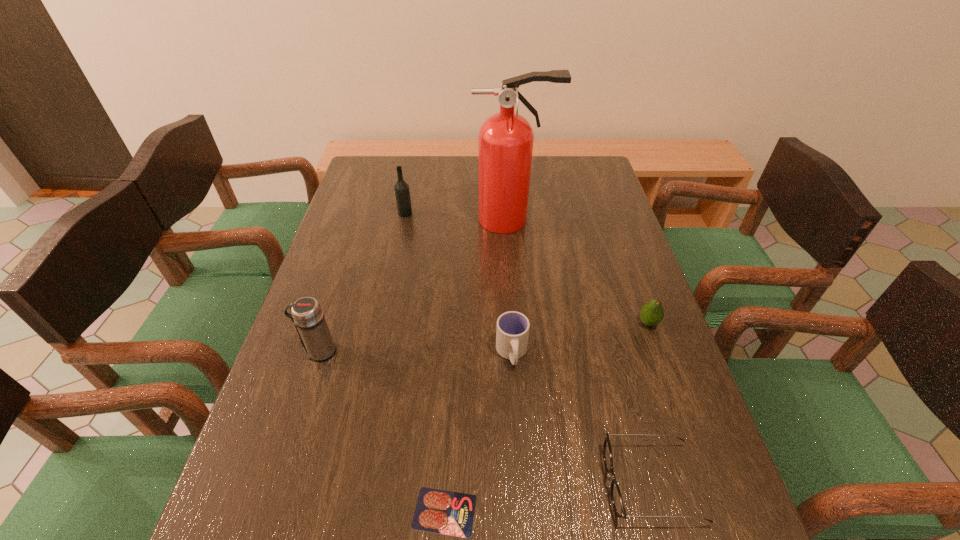
At what (x,y) coordinates should I click in order to perform the action: click on the tallest object. Please return your answer as a coordinate pair (x, y). The width and height of the screenshot is (960, 540). Looking at the image, I should click on point(505,140).

This screenshot has height=540, width=960. What are the coordinates of `the sixth object from right to left` in the screenshot? It's located at (402, 192).

You are a GUI agent. You are given a task and a screenshot of the screen. Output one action in this format:
    pyautogui.click(x=<x>, y=<y>)
    Task: Click on the thermos bottle
    The width and height of the screenshot is (960, 540).
    Given the screenshot: What is the action you would take?
    pyautogui.click(x=307, y=315)

At what (x,y) coordinates should I click in order to perform the action: click on cup. Please return your answer as a coordinate pair (x, y). Image resolution: width=960 pixels, height=540 pixels. Looking at the image, I should click on (512, 332).

Locate an element on the screen. avocado is located at coordinates (652, 313).

Locate an element on the screen. Image resolution: width=960 pixels, height=540 pixels. spectacles is located at coordinates (616, 497).

The image size is (960, 540). Identify the location of the shortest object. (451, 513).

This screenshot has height=540, width=960. I want to click on free region located on the back of the tallest object, so click(508, 175).

Where is `free location located 0.220m on the right of the sixth object from right to left`? This screenshot has height=540, width=960. free location located 0.220m on the right of the sixth object from right to left is located at coordinates (480, 213).

Find the location of `vacant position located 0.240m with the handle on the side of the cup`. vacant position located 0.240m with the handle on the side of the cup is located at coordinates (520, 482).